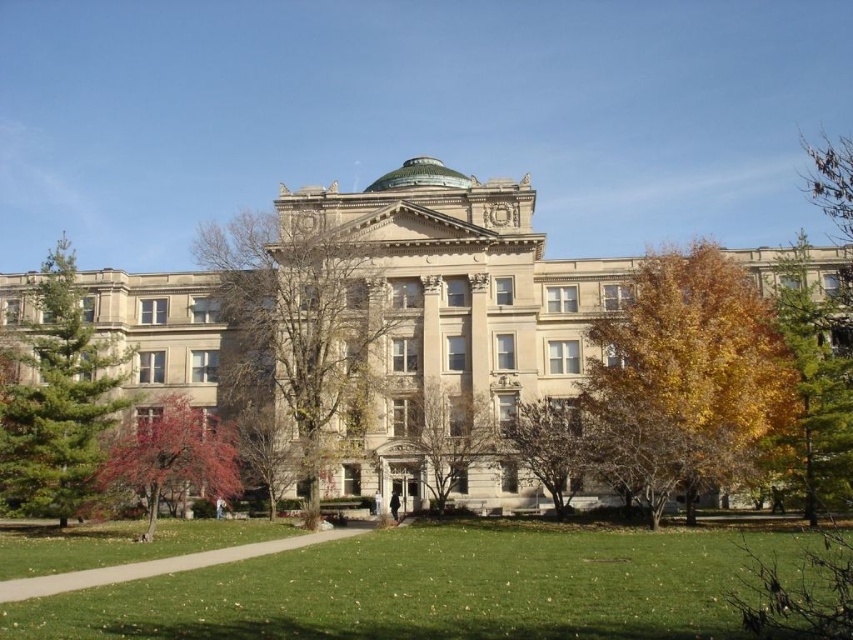
Does yellow leafy tree at right appear on the right side of reddish-brown bark tree at lower left?

Correct, you'll find yellow leafy tree at right to the right of reddish-brown bark tree at lower left.

Which is below, yellow leafy tree at right or reddish-brown bark tree at lower left?

reddish-brown bark tree at lower left is lower down.

Is point (738, 282) less distant than point (119, 461)?

That is False.

Where is `yellow leafy tree at right`? This screenshot has width=853, height=640. yellow leafy tree at right is located at coordinates (689, 372).

Which is below, yellow leafy tree at right or green coniferous tree at left?

yellow leafy tree at right is lower down.

Does yellow leafy tree at right have a greater height compared to green coniferous tree at left?

No, yellow leafy tree at right is not taller than green coniferous tree at left.

Between point (672, 458) and point (73, 369), which one is positioned in front?

Point (672, 458) is more forward.

Locate an element on the screen. yellow leafy tree at right is located at coordinates (689, 372).

Between yellow leafy tree at right and yellow-green leaves at lower center, which one is positioned lower?

yellow-green leaves at lower center is lower down.

Based on the photo, can you confirm if yellow leafy tree at right is wider than yellow-green leaves at lower center?

Indeed, yellow leafy tree at right has a greater width compared to yellow-green leaves at lower center.

Which is behind, point (651, 362) or point (583, 456)?

The point (651, 362) is behind.

Locate an element on the screen. This screenshot has height=640, width=853. yellow leafy tree at right is located at coordinates (689, 372).